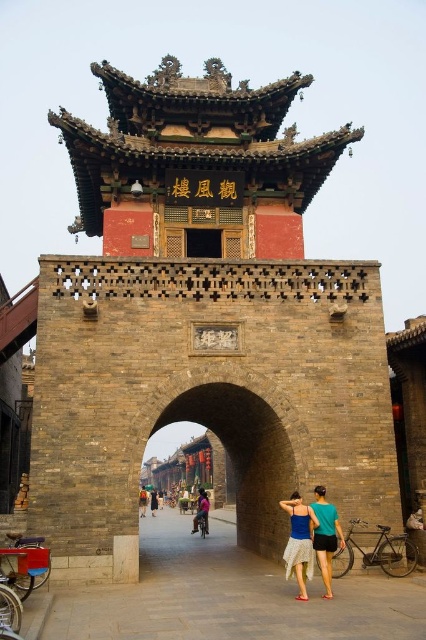
Question: Is brown stone tower at center positioned at the back of dark brown leather jacket at center?

Choices:
 (A) no
 (B) yes

Answer: (A)

Question: Estimate the real-world distances between objects in this image. Which object is closer to the pink fabric dress at center?

Choices:
 (A) blue denim skirt at center
 (B) brown stone tower at center

Answer: (B)

Question: Does blue denim skirt at center appear on the right side of pink fabric dress at center?

Choices:
 (A) yes
 (B) no

Answer: (A)

Question: Considering the relative positions of brown stone tower at center and pink fabric dress at center in the image provided, where is brown stone tower at center located with respect to pink fabric dress at center?

Choices:
 (A) left
 (B) right

Answer: (B)

Question: Which object is positioned farthest from the pink fabric dress at center?

Choices:
 (A) blue denim skirt at center
 (B) brown stone tower at center

Answer: (A)

Question: Which object is farther from the camera taking this photo?

Choices:
 (A) blue denim skirt at center
 (B) pink fabric dress at center

Answer: (B)